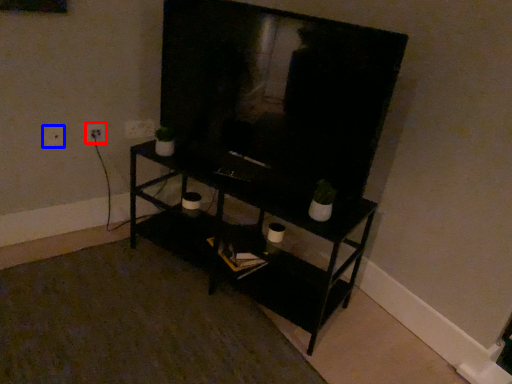
Question: Which point is closer to the camera, electric outlet (highlighted by a red box) or electric outlet (highlighted by a blue box)?

Choices:
 (A) electric outlet
 (B) electric outlet

Answer: (B)